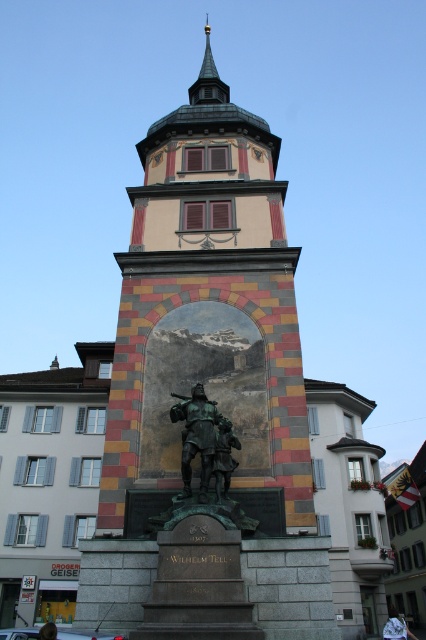
The height and width of the screenshot is (640, 426). What do you see at coordinates (207, 310) in the screenshot?
I see `multicolored stone tower at center` at bounding box center [207, 310].

Find the location of a particular element. The height and width of the screenshot is (640, 426). multicolored stone tower at center is located at coordinates (207, 310).

Does bronze statue at center appear on the left side of gold spire at upper center?

Incorrect, bronze statue at center is not on the left side of gold spire at upper center.

This screenshot has height=640, width=426. What do you see at coordinates (204, 442) in the screenshot?
I see `bronze statue at center` at bounding box center [204, 442].

This screenshot has width=426, height=640. In order to click on bronze statue at center in this screenshot , I will do `click(204, 442)`.

This screenshot has height=640, width=426. What are the coordinates of `bronze statue at center` in the screenshot? It's located at (204, 442).

From the picture: Who is more forward, (247, 355) or (199, 381)?

Point (199, 381) is in front.

Consider the image. Who is taller, multicolored stone tower at center or bronze statue at center?

Standing taller between the two is multicolored stone tower at center.

The height and width of the screenshot is (640, 426). I want to click on multicolored stone tower at center, so click(x=207, y=310).